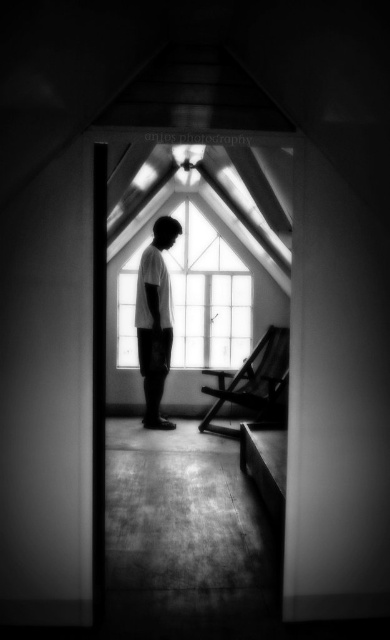
Between transparent glass window at center and white matte shirt at center, which one appears on the left side from the viewer's perspective?

white matte shirt at center is more to the left.

Is point (248, 314) farther from viewer compared to point (136, 294)?

Yes, point (248, 314) is behind point (136, 294).

Between point (246, 294) and point (161, 300), which one is positioned behind?

The point (246, 294) is more distant.

At what (x,y) coordinates should I click in order to perform the action: click on transparent glass window at center. Please return your answer as a coordinate pair (x, y). The height and width of the screenshot is (640, 390). Looking at the image, I should click on (207, 296).